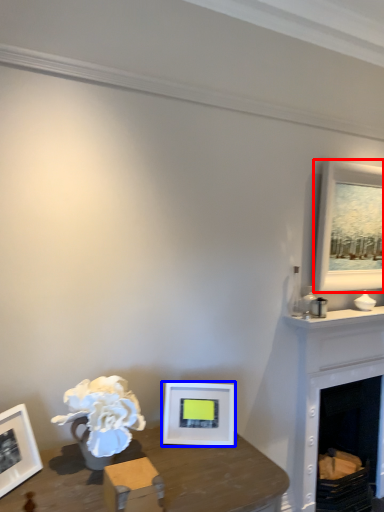
Question: Among these objects, which one is nearest to the camera, picture frame (highlighted by a red box) or picture frame (highlighted by a blue box)?

Choices:
 (A) picture frame
 (B) picture frame

Answer: (B)